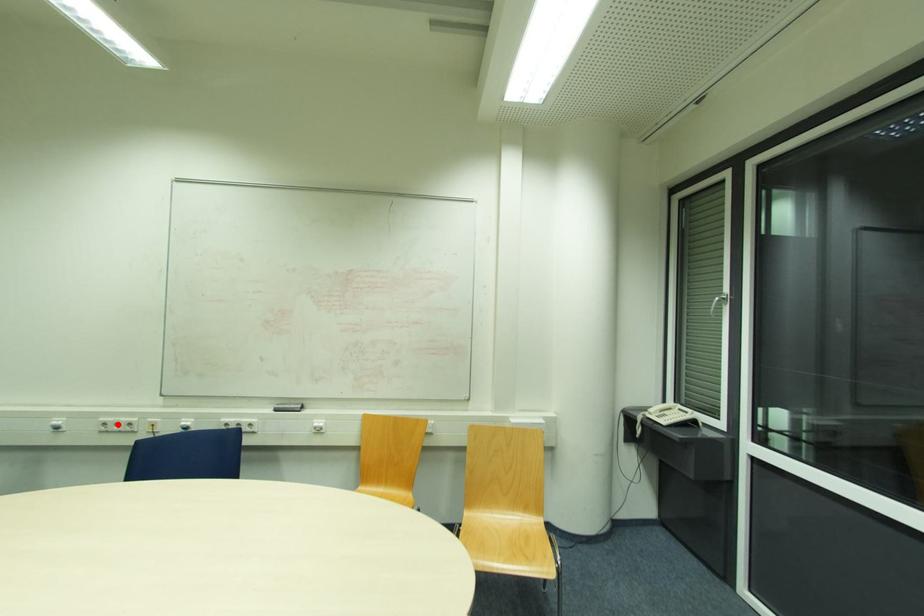
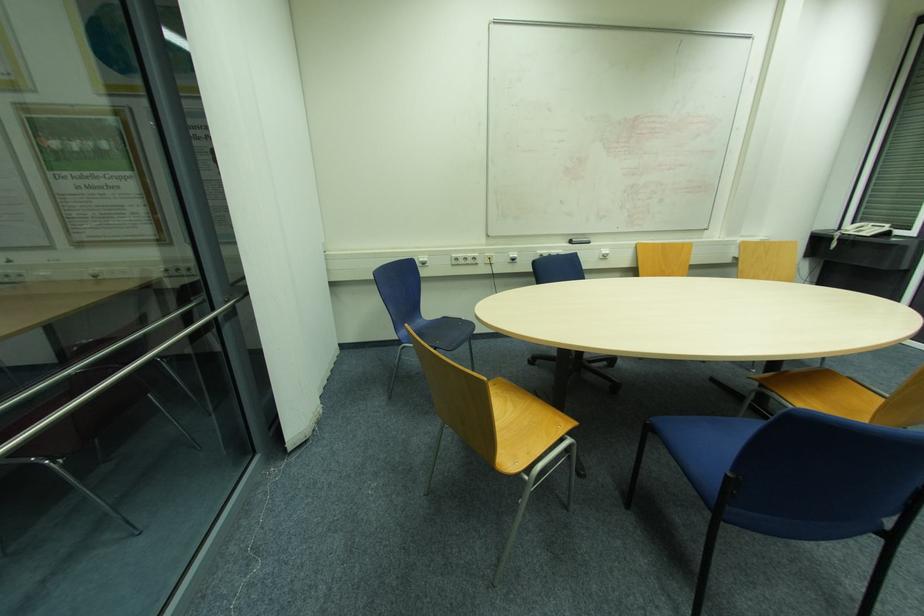
Locate, in the second image, the point that corresponds to the highlighted location in the first image.

(467, 259)